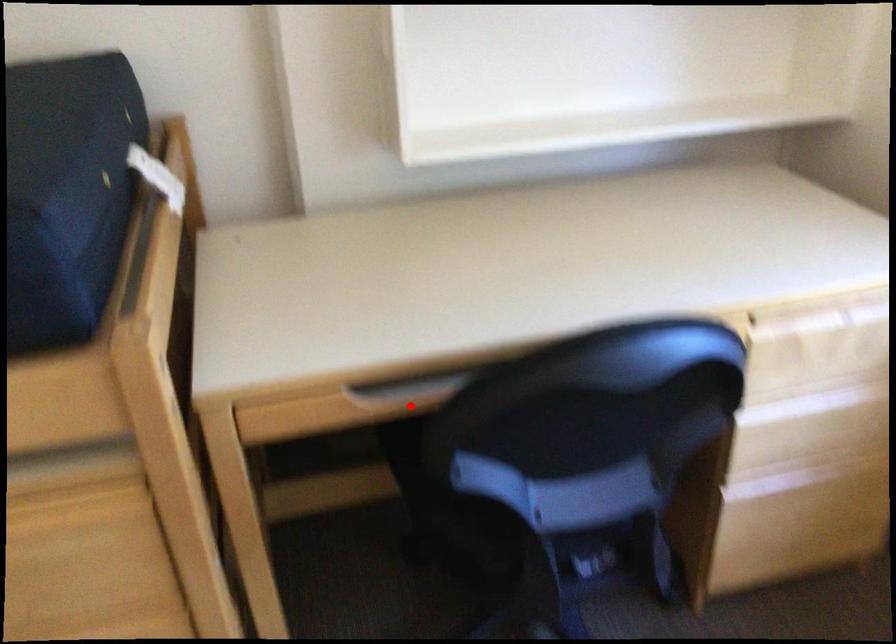
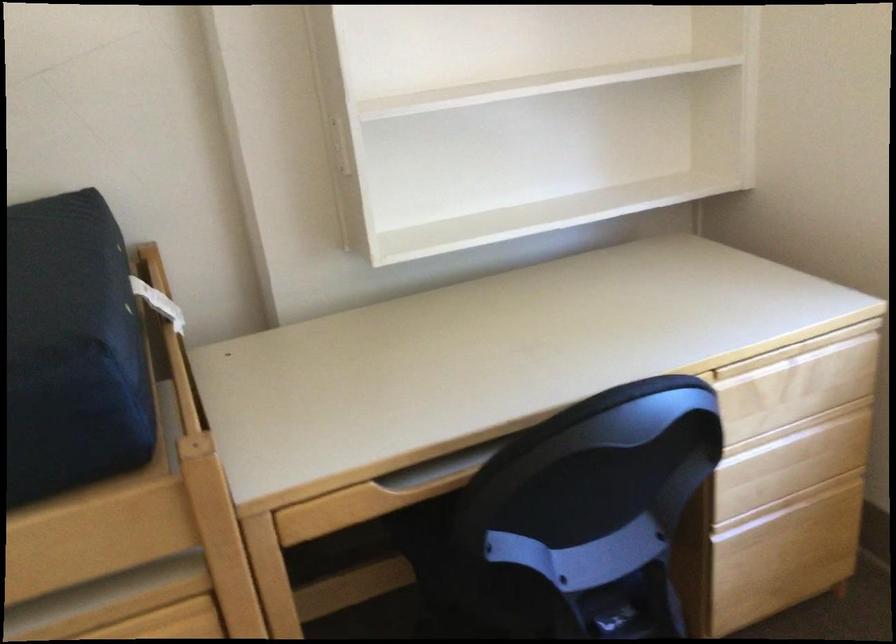
Where in the second image is the point corresponding to the highlighted location from the first image?

(431, 489)